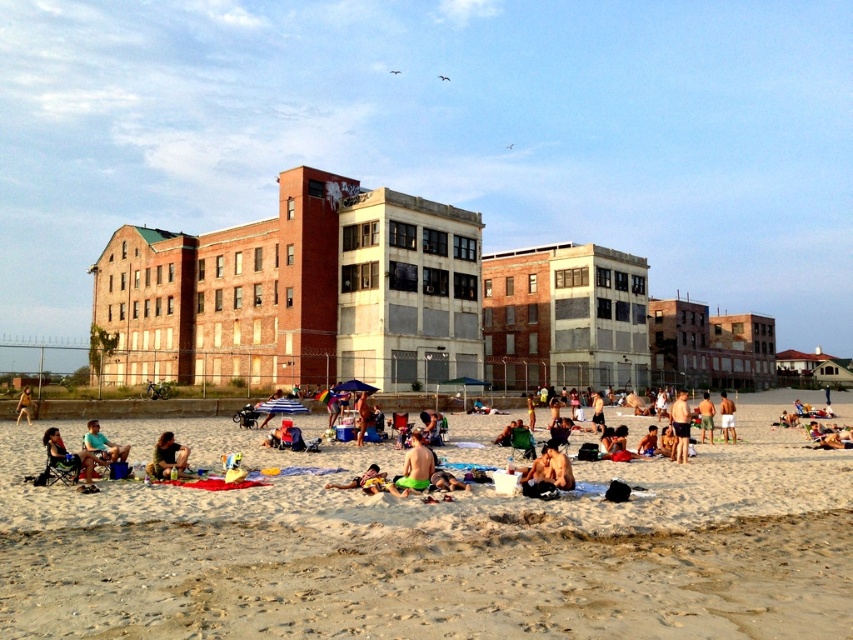
This screenshot has height=640, width=853. What do you see at coordinates (433, 547) in the screenshot? I see `beige sand at center` at bounding box center [433, 547].

Does beige sand at center appear on the left side of brown fabric bag at center?

Incorrect, beige sand at center is not on the left side of brown fabric bag at center.

Does point (242, 502) come behind point (154, 461)?

That is False.

Identify the location of beige sand at center. (x=433, y=547).

Is green shorts at center in front of brown leather jacket at lower left?

Yes.

Between green shorts at center and brown leather jacket at lower left, which one is positioned lower?

green shorts at center

Who is more forward, (734, 440) or (18, 420)?

Point (734, 440) is in front.

Find the location of `green shorts at center`. green shorts at center is located at coordinates (727, 417).

Can you confirm if brown fabric bag at center is taller than smooth tan skin at center?

Yes, brown fabric bag at center is taller than smooth tan skin at center.

Is brown fabric bag at center to the left of smooth tan skin at center from the viewer's perspective?

Correct, you'll find brown fabric bag at center to the left of smooth tan skin at center.

Between point (154, 461) and point (360, 401), which one is positioned behind?

The point (360, 401) is behind.

Find the location of a particular element. brown fabric bag at center is located at coordinates (167, 456).